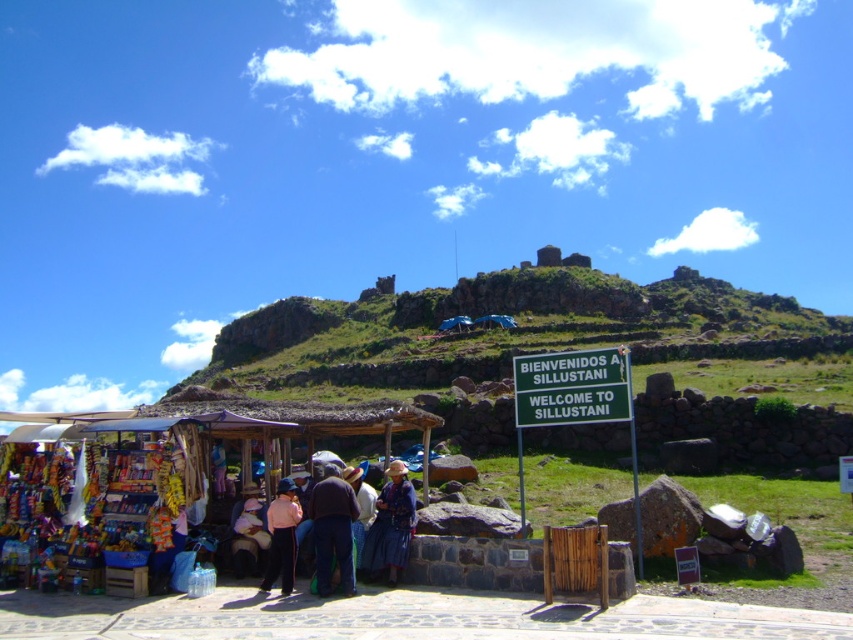
Question: Does matte pink shirt at center have a smaller size compared to blue woven hat at center?

Choices:
 (A) yes
 (B) no

Answer: (A)

Question: Does wooden stall at lower left have a larger size compared to blue fabric dress at center?

Choices:
 (A) no
 (B) yes

Answer: (B)

Question: Can you confirm if wooden stall at lower left is positioned below blue woven hat at center?

Choices:
 (A) yes
 (B) no

Answer: (A)

Question: Which point is closer to the camera taking this photo?

Choices:
 (A) (312, 532)
 (B) (280, 531)

Answer: (B)

Question: Estimate the real-world distances between objects in this image. Which object is closer to the matte pink shirt at center?

Choices:
 (A) blue woven hat at center
 (B) wooden stall at lower left
 (C) brown woven hat at center

Answer: (C)

Question: Estimate the real-world distances between objects in this image. Which object is closer to the matte pink shirt at center?

Choices:
 (A) brown woven hat at center
 (B) wooden stall at lower left
 (C) blue woven skirt at center
 (D) blue woven hat at center

Answer: (A)